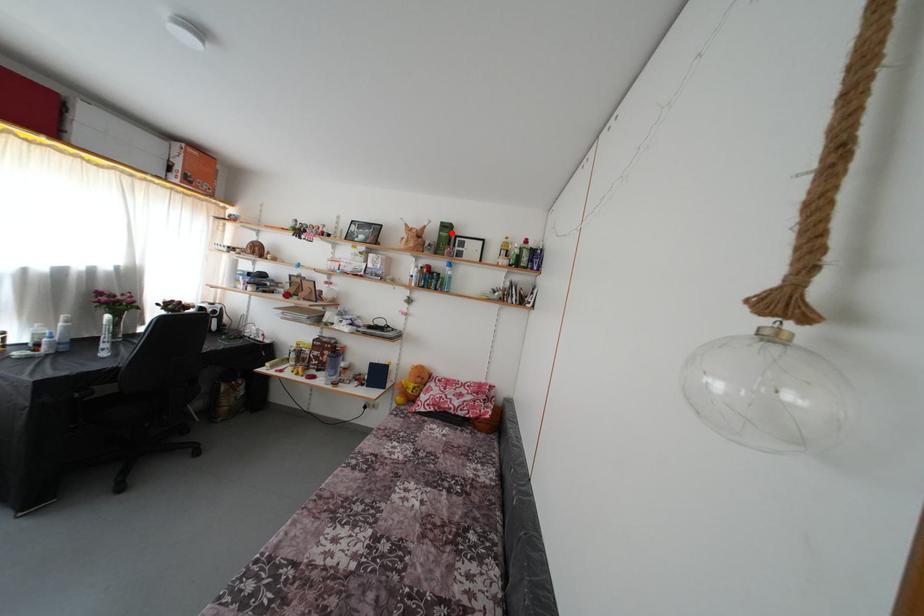
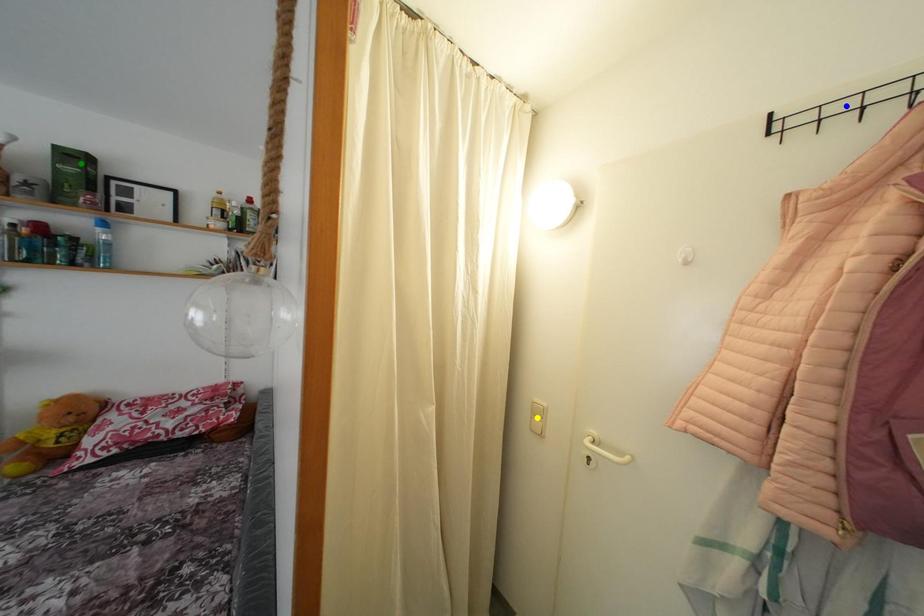
Question: I am providing you with two images of the same scene from different viewpoints. A red point is marked on the first image. You are given multiple points on the second image. Which spot in image 2 lines up with the point in image 1?

Choices:
 (A) green point
 (B) blue point
 (C) yellow point

Answer: (A)